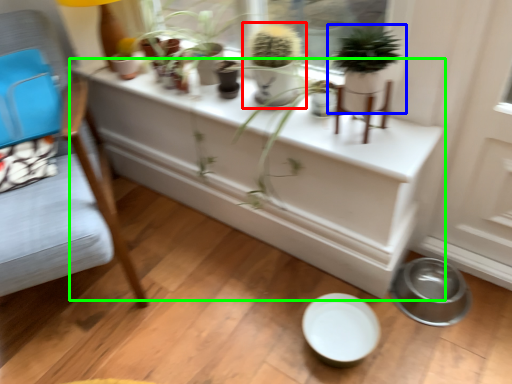
Question: Which object is positioned farthest from houseplant (highlighted by a red box)? Select from houseplant (highlighted by a blue box) and table (highlighted by a green box).

Choices:
 (A) houseplant
 (B) table

Answer: (B)